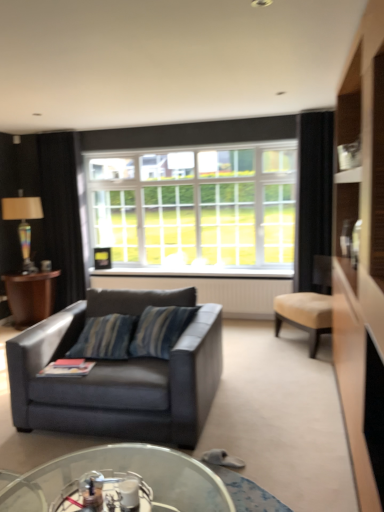
Question: From the image's perspective, would you say transparent glass coffee table at lower center is shown under multicolored glass lamp at left?

Choices:
 (A) no
 (B) yes

Answer: (B)

Question: Is transparent glass coffee table at lower center shorter than multicolored glass lamp at left?

Choices:
 (A) yes
 (B) no

Answer: (A)

Question: Considering the relative sizes of transparent glass coffee table at lower center and multicolored glass lamp at left in the image provided, is transparent glass coffee table at lower center taller than multicolored glass lamp at left?

Choices:
 (A) yes
 (B) no

Answer: (B)

Question: Would you say transparent glass coffee table at lower center is outside multicolored glass lamp at left?

Choices:
 (A) no
 (B) yes

Answer: (B)

Question: Can you confirm if transparent glass coffee table at lower center is wider than multicolored glass lamp at left?

Choices:
 (A) no
 (B) yes

Answer: (B)

Question: Is point (241, 161) positioned closer to the camera than point (72, 217)?

Choices:
 (A) closer
 (B) farther

Answer: (B)

Question: Is white glass window at center bigger or smaller than black fabric curtain at left, positioned as the second curtain in right-to-left order?

Choices:
 (A) small
 (B) big

Answer: (B)

Question: From a real-world perspective, relative to black fabric curtain at left, the 2th curtain when ordered from front to back, is white glass window at center vertically above or below?

Choices:
 (A) above
 (B) below

Answer: (A)

Question: From the image's perspective, is white glass window at center located above or below black fabric curtain at left, placed as the 1th curtain when sorted from back to front?

Choices:
 (A) above
 (B) below

Answer: (A)

Question: Considering the positions of white textured radiator at center and multicolored glass lamp at left in the image, is white textured radiator at center bigger or smaller than multicolored glass lamp at left?

Choices:
 (A) big
 (B) small

Answer: (A)

Question: Relative to multicolored glass lamp at left, is white textured radiator at center in front or behind?

Choices:
 (A) front
 (B) behind

Answer: (A)

Question: From the image's perspective, is white textured radiator at center positioned above or below multicolored glass lamp at left?

Choices:
 (A) below
 (B) above

Answer: (A)

Question: Looking at their shapes, would you say white textured radiator at center is wider or thinner than multicolored glass lamp at left?

Choices:
 (A) wide
 (B) thin

Answer: (B)

Question: From a real-world perspective, is black fabric curtain at right, the 1th curtain viewed from the front, above or below transparent glass coffee table at lower center?

Choices:
 (A) above
 (B) below

Answer: (A)

Question: Considering the positions of point (306, 177) and point (107, 501), is point (306, 177) closer or farther from the camera than point (107, 501)?

Choices:
 (A) farther
 (B) closer

Answer: (A)